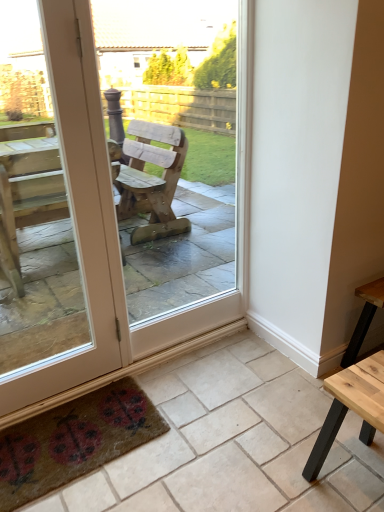
The image size is (384, 512). What are the coordinates of `vacant area situated to the left side of light brown wooden table at lower right` in the screenshot? It's located at (x=281, y=468).